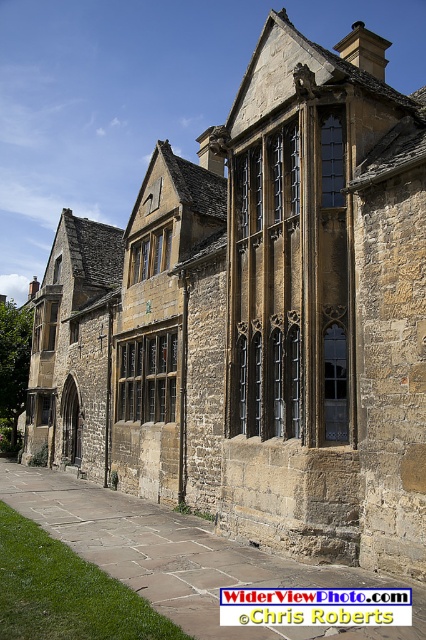
Does matte stone window at center appear on the right side of dark glass window at center?

No, matte stone window at center is not to the right of dark glass window at center.

Is matte stone window at center below dark glass window at center?

Yes.

Which is behind, point (152, 384) or point (322, 196)?

The point (152, 384) is more distant.

Identify the location of matte stone window at center. This screenshot has height=640, width=426. (147, 378).

Can you confirm if matte stone window at center is bigger than matte stone window at upper center?

Yes, matte stone window at center is bigger than matte stone window at upper center.

The width and height of the screenshot is (426, 640). I want to click on matte stone window at center, so click(x=147, y=378).

Is dark glass window at center to the right of matte stone window at upper center from the viewer's perspective?

Correct, you'll find dark glass window at center to the right of matte stone window at upper center.

Does point (336, 128) come closer to viewer compared to point (166, 260)?

Yes.

Where is `dark glass window at center`? The height and width of the screenshot is (640, 426). dark glass window at center is located at coordinates (331, 161).